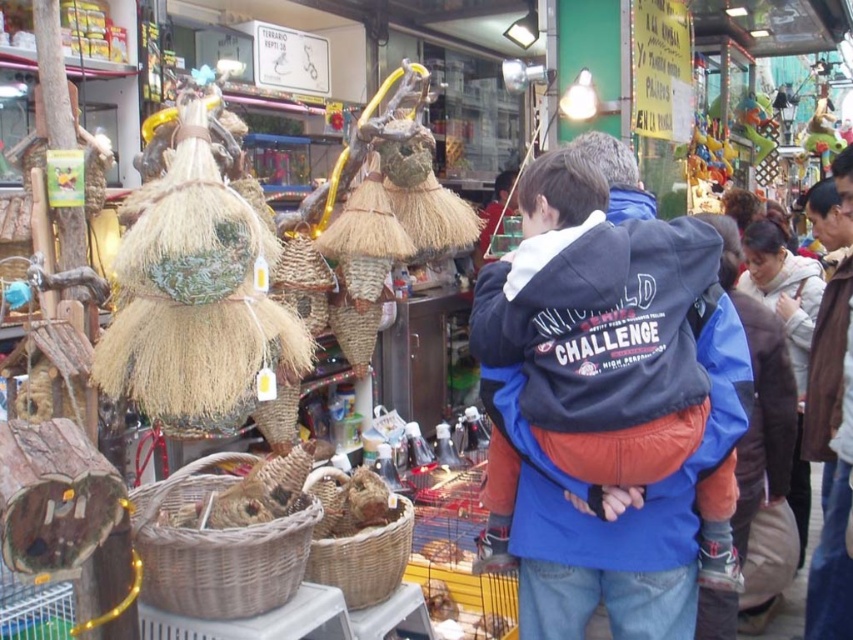
Question: Among these objects, which one is farthest from the camera?

Choices:
 (A) woven brown basket at center
 (B) woven brown basket at lower center

Answer: (B)

Question: Can you confirm if woven brown basket at center is positioned above woven brown basket at lower center?

Choices:
 (A) yes
 (B) no

Answer: (A)

Question: Which of the following is the farthest from the observer?

Choices:
 (A) (360, 545)
 (B) (486, 269)

Answer: (A)

Question: Observing the image, what is the correct spatial positioning of blue fleece jacket at center in reference to woven brown basket at lower center?

Choices:
 (A) above
 (B) below

Answer: (A)

Question: Among these objects, which one is nearest to the camera?

Choices:
 (A) blue fleece jacket at center
 (B) woven brown basket at center

Answer: (A)

Question: Can you confirm if blue fleece jacket at center is positioned above woven brown basket at center?

Choices:
 (A) no
 (B) yes

Answer: (B)